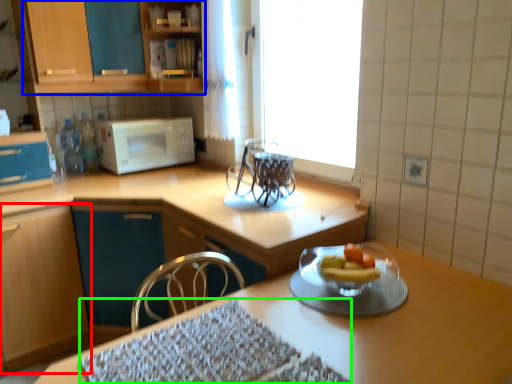
Question: Which object is positioned closest to cabinetry (highlighted by a red box)? Select from cabinetry (highlighted by a blue box) and place mat (highlighted by a green box).

Choices:
 (A) cabinetry
 (B) place mat

Answer: (A)